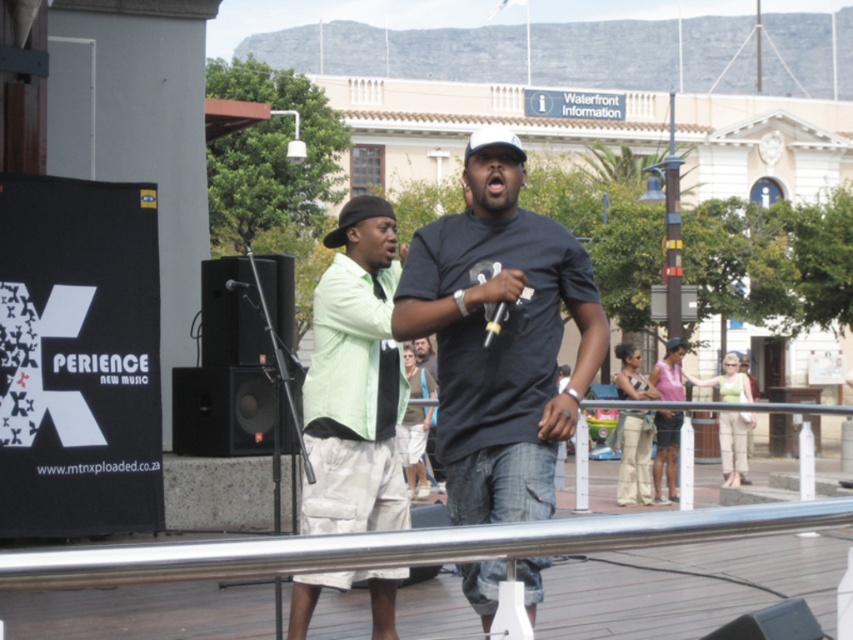
You are a photographer standing behind the stage. You want to take a photo of the light green shirt at center and the black matte microphone at center. Based on their positions, which object should you focus on first to ensure both are in frame?

The light green shirt at center is to the right of the black matte microphone at center, so you should focus on the black matte microphone at center first to ensure both are in frame.